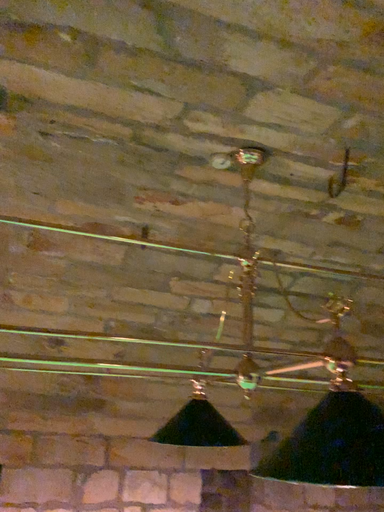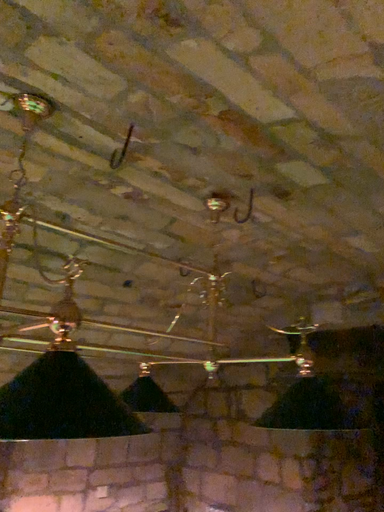
Question: Which way did the camera rotate in the video?

Choices:
 (A) rotated left
 (B) rotated right

Answer: (B)